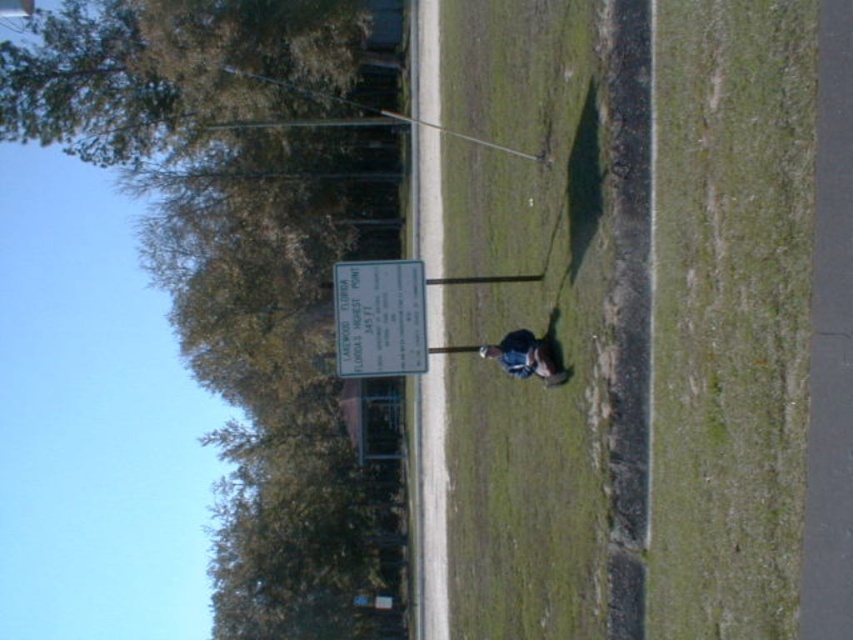
You are planning to install a new streetlight in this area. Considering the green leafy tree at upper left and the dark blue denim jacket at center, which object would cast a longer shadow during midday?

The green leafy tree at upper left would cast a longer shadow during midday because it is much taller than the dark blue denim jacket at center.

You are standing on the green grass at center and want to reach the white plastic sign at center. Which direction should you move to get closer to the sign?

The white plastic sign at center is further away from you than the green grass at center. To reach the sign, you should move forward away from the green grass at center towards the sign.

You are a gardener who needs to mow the green grass at center. However, there is a white plastic sign at center in the way. Can you mow the grass without moving the sign?

The green grass at center is above the white plastic sign at center, so you can mow the grass without moving the sign because the sign is positioned below the grass area.